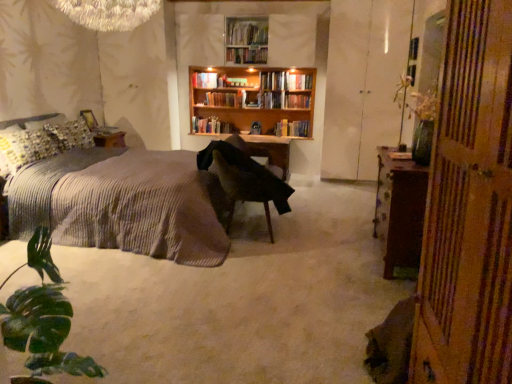
Image resolution: width=512 pixels, height=384 pixels. I want to click on hardcover book at center, acting as the 3th book starting from the bottom, so click(x=298, y=81).

What do you see at coordinates (266, 151) in the screenshot? The width and height of the screenshot is (512, 384). I see `wooden table at center` at bounding box center [266, 151].

Identify the location of brown wooden cabinet at right. This screenshot has height=384, width=512. pos(400,212).

Identify the location of hardcover book at center, marked as the 2th book in a top-to-bottom arrangement. (205, 80).

The width and height of the screenshot is (512, 384). In order to click on hardcover book at center, arranged as the 3th book when viewed from the top in this screenshot , I will do `click(298, 81)`.

Is hardcover book at center, marked as the 2th book in a top-to-bottom arrangement, next to black fabric chair at center?

hardcover book at center, marked as the 2th book in a top-to-bottom arrangement, and black fabric chair at center are clearly separated.

Could black fabric chair at center be considered to be inside hardcover book at center, marked as the 2th book in a top-to-bottom arrangement?

No, black fabric chair at center is not a part of hardcover book at center, marked as the 2th book in a top-to-bottom arrangement.

From the image's perspective, is hardcover book at center, positioned as the fourth book in bottom-to-top order, above or below black fabric chair at center?

hardcover book at center, positioned as the fourth book in bottom-to-top order, is situated higher than black fabric chair at center in the image.

Does hardcover book at center, marked as the 2th book in a top-to-bottom arrangement, have a lesser height compared to black fabric chair at center?

Yes, hardcover book at center, marked as the 2th book in a top-to-bottom arrangement, is shorter than black fabric chair at center.

From a real-world perspective, is green glass vase at right located beneath wooden bookshelf at upper center?

Yes, from a real-world perspective, green glass vase at right is under wooden bookshelf at upper center.

In the image, is green glass vase at right on the left side or the right side of wooden bookshelf at upper center?

From the image, it's evident that green glass vase at right is to the right of wooden bookshelf at upper center.

Between green glass vase at right and wooden bookshelf at upper center, which one is positioned behind?

wooden bookshelf at upper center is further from the camera.

Between green glass vase at right and wooden bookshelf at upper center, which one has more height?

With more height is green glass vase at right.

Which object is more forward, black fabric chair at center or green glass vase at right?

Positioned in front is green glass vase at right.

Considering the sizes of objects black fabric chair at center and green glass vase at right in the image provided, who is taller, black fabric chair at center or green glass vase at right?

green glass vase at right is taller.

Considering the positions of point (206, 168) and point (497, 365), is point (206, 168) closer or farther from the camera than point (497, 365)?

Point (206, 168).

Who is smaller, brown wooden cabinet at right or white glossy cabinet at right?

brown wooden cabinet at right.

From a real-world perspective, which is physically above, brown wooden cabinet at right or white glossy cabinet at right?

white glossy cabinet at right.

From the image's perspective, which one is positioned higher, brown wooden cabinet at right or white glossy cabinet at right?

white glossy cabinet at right.

How different are the orientations of brown wooden cabinet at right and white glossy cabinet at right in degrees?

The facing directions of brown wooden cabinet at right and white glossy cabinet at right are 91 degrees apart.

Is hardcover book at center, marked as the 2th book in a top-to-bottom arrangement, further to the viewer compared to wooden bookshelf at center, the 1th book viewed from the top?

Yes, it is behind wooden bookshelf at center, the 1th book viewed from the top.

Is hardcover book at center, positioned as the fourth book in bottom-to-top order, not near wooden bookshelf at center, the 1th book viewed from the top?

That's not correct — hardcover book at center, positioned as the fourth book in bottom-to-top order, is a little close to wooden bookshelf at center, the 1th book viewed from the top.

This screenshot has height=384, width=512. Identify the location of book that is the 2nd one when counting backward from the wooden bookshelf at center, which is counted as the 5th book, starting from the bottom. (205, 80).

Consider the image. Can you confirm if hardcover book at center, marked as the 2th book in a top-to-bottom arrangement, is taller than wooden bookshelf at center, the 1th book viewed from the top?

In fact, hardcover book at center, marked as the 2th book in a top-to-bottom arrangement, may be shorter than wooden bookshelf at center, the 1th book viewed from the top.

You are a GUI agent. You are given a task and a screenshot of the screen. Output one action in this format:
    pyautogui.click(x=<x>, y=<y>)
    Task: Click on the table located on the right of wooden bookshelf at upper center
    
    Given the screenshot: What is the action you would take?
    pyautogui.click(x=266, y=151)

Does wooden bookshelf at upper center have a smaller size compared to wooden table at center?

No, wooden bookshelf at upper center is not smaller than wooden table at center.

Is wooden bookshelf at upper center inside or outside of wooden table at center?

wooden bookshelf at upper center lies outside wooden table at center.

Is wooden bookshelf at upper center aimed at wooden table at center?

No.

Consider the image. Could you measure the distance between wooden bookshelf at center, the 1th book viewed from the top, and wooden table at center?

wooden bookshelf at center, the 1th book viewed from the top, and wooden table at center are 3.93 feet apart from each other.

Does wooden bookshelf at center, which is counted as the 5th book, starting from the bottom, have a greater height compared to wooden table at center?

In fact, wooden bookshelf at center, which is counted as the 5th book, starting from the bottom, may be shorter than wooden table at center.

Is wooden bookshelf at center, the 1th book viewed from the top, in front of or behind wooden table at center in the image?

wooden bookshelf at center, the 1th book viewed from the top, is in front of wooden table at center.

Is wooden bookshelf at center, the 1th book viewed from the top, bigger than wooden table at center?

No, wooden bookshelf at center, the 1th book viewed from the top, is not bigger than wooden table at center.

You are a GUI agent. You are given a task and a screenshot of the screen. Output one action in this format:
    pyautogui.click(x=<x>, y=<y>)
    Task: Click on the chair in front of the hardcover book at center, marked as the 2th book in a top-to-bottom arrangement
    Image resolution: width=512 pixels, height=384 pixels.
    Given the screenshot: What is the action you would take?
    click(x=245, y=179)

Find the location of a particular element. Image resolution: width=512 pixels, height=384 pixels. bookcase above the green glass vase at right (from the image's perspective) is located at coordinates (251, 102).

Based on their spatial positions, is wooden bookshelf at center, which is counted as the 5th book, starting from the bottom, or white glossy cabinet at right closer to hardcover books at center, the fifth book when ordered from top to bottom?

wooden bookshelf at center, which is counted as the 5th book, starting from the bottom.

Considering their positions, is wooden bookshelf at upper center positioned further to brown wooden cabinet at right than wooden table at center?

wooden bookshelf at upper center.

When comparing their distances from green glass vase at right, does wooden bookshelf at upper center or hardcover books at center, the fifth book when ordered from top to bottom, seem closer?

wooden bookshelf at upper center is positioned closer to the anchor green glass vase at right.

From the image, which object appears to be farther from white glossy cabinet at right, textured gray bedspread at left or brown wooden cabinet at right?

textured gray bedspread at left is further to white glossy cabinet at right.

Looking at the image, which one is located closer to green glass vase at right, white glossy cabinet at right or green leafy plant at lower left?

The object closer to green glass vase at right is green leafy plant at lower left.

Based on their spatial positions, is wooden table at center or textured gray bedspread at left further from black fabric chair at center?

wooden table at center is positioned further to the anchor black fabric chair at center.

Which object lies further to the anchor point hardcover books at center, the 1th book when ordered from bottom to top, wooden table at center or hardcover book at center, which is the 2th book from bottom to top?

wooden table at center.

Estimate the real-world distances between objects in this image. Which object is closer to green leafy plant at lower left, wooden table at center or hardcover book at center, marked as the 2th book in a top-to-bottom arrangement?

wooden table at center is positioned closer to the anchor green leafy plant at lower left.

Where is `bookcase between wooden bookshelf at upper center and hardcover book at center, arranged as the 3th book when viewed from the top, from left to right`? This screenshot has width=512, height=384. bookcase between wooden bookshelf at upper center and hardcover book at center, arranged as the 3th book when viewed from the top, from left to right is located at coordinates (251, 102).

You are a GUI agent. You are given a task and a screenshot of the screen. Output one action in this format:
    pyautogui.click(x=<x>, y=<y>)
    Task: Click on the book situated between wooden bookshelf at upper center and white glossy cabinet at right from left to right
    This screenshot has height=384, width=512.
    Given the screenshot: What is the action you would take?
    pyautogui.click(x=298, y=81)

Where is `table positioned between brown wooden cabinet at right and hardcover book at center, which is the 2th book from bottom to top, from near to far`? This screenshot has width=512, height=384. table positioned between brown wooden cabinet at right and hardcover book at center, which is the 2th book from bottom to top, from near to far is located at coordinates (266, 151).

Where is `book positioned between brown wooden cabinet at right and hardcover book at center, arranged as the 3th book when viewed from the top, from near to far`? The image size is (512, 384). book positioned between brown wooden cabinet at right and hardcover book at center, arranged as the 3th book when viewed from the top, from near to far is located at coordinates (247, 55).